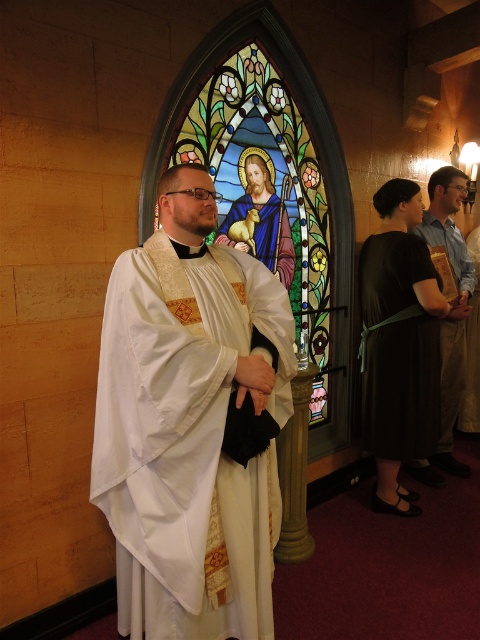
Question: Which is nearer to the light blue shirt at center?

Choices:
 (A) black satin dress at center
 (B) stained glass at center
 (C) matte white robe at center
 (D) white satin robe at center

Answer: (A)

Question: Is stained glass at center further to camera compared to matte white robe at center?

Choices:
 (A) yes
 (B) no

Answer: (B)

Question: Is light blue shirt at center positioned in front of matte white robe at center?

Choices:
 (A) yes
 (B) no

Answer: (B)

Question: Which of these objects is positioned closest to the matte white robe at center?

Choices:
 (A) white satin robe at center
 (B) light blue shirt at center
 (C) black satin dress at center

Answer: (C)

Question: Which of these objects is positioned farthest from the light blue shirt at center?

Choices:
 (A) matte white robe at center
 (B) black satin dress at center
 (C) stained glass at center

Answer: (A)

Question: Where is black satin dress at center located in relation to matte white robe at center in the image?

Choices:
 (A) above
 (B) below

Answer: (B)